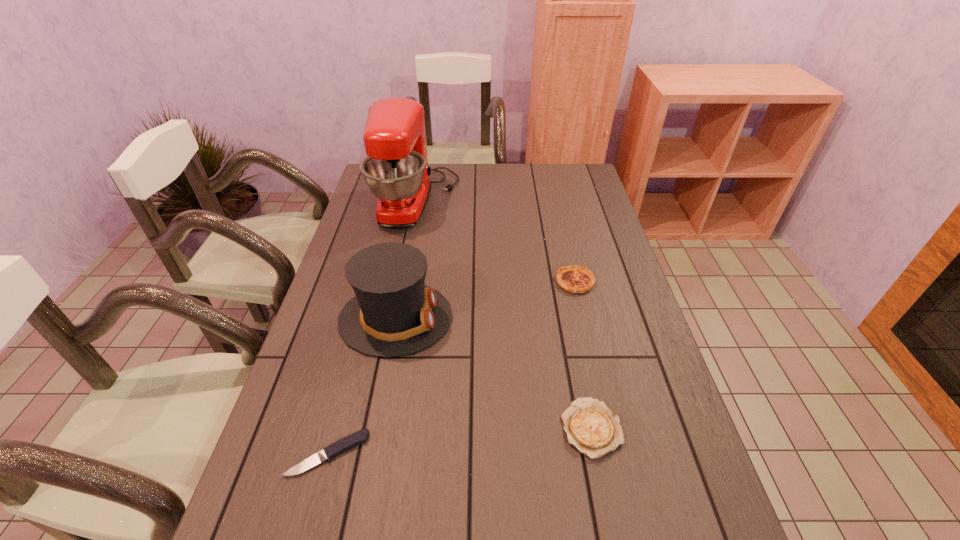
Where is `free space located 0.340m on the left of the nearer quiche`? The image size is (960, 540). free space located 0.340m on the left of the nearer quiche is located at coordinates (404, 428).

You are a GUI agent. You are given a task and a screenshot of the screen. Output one action in this format:
    pyautogui.click(x=<x>, y=<y>)
    Task: Click on the free region located 0.060m on the front of the steak knife
    
    Given the screenshot: What is the action you would take?
    pyautogui.click(x=313, y=510)

Locate an element on the screen. object that is positioned at the far edge is located at coordinates (396, 170).

Locate an element on the screen. The width and height of the screenshot is (960, 540). kitchen mixer positioned at the left edge is located at coordinates (396, 170).

Identify the location of dress hat that is positioned at the left edge. The height and width of the screenshot is (540, 960). (394, 313).

At what (x,y) coordinates should I click in order to perform the action: click on steak knife located at the left edge. Please return your answer as a coordinate pair (x, y). This screenshot has height=540, width=960. Looking at the image, I should click on (361, 436).

Where is `object that is at the far left corner`? object that is at the far left corner is located at coordinates (396, 170).

Identify the location of vacant space at the far edge of the desktop. The height and width of the screenshot is (540, 960). (503, 180).

Locate an element on the screen. blank space at the left edge of the desktop is located at coordinates (x=359, y=356).

The image size is (960, 540). Identify the location of free spot at the right edge of the desktop. pos(615,333).